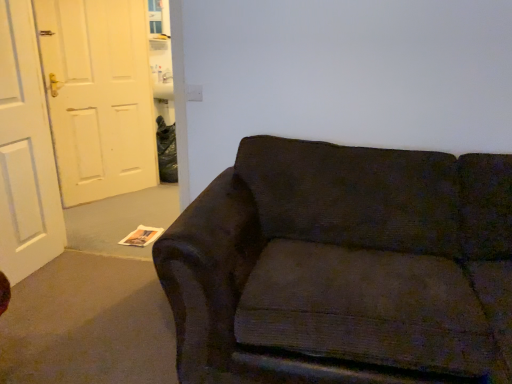
Question: Is white matte door at left, which is counted as the second door, starting from the front, completely or partially outside of dark fabric couch at center?

Choices:
 (A) yes
 (B) no

Answer: (A)

Question: Can you confirm if white matte door at left, the 1th door positioned from the back, is taller than dark fabric couch at center?

Choices:
 (A) no
 (B) yes

Answer: (B)

Question: Considering the relative sizes of white matte door at left, the 1th door positioned from the back, and dark fabric couch at center in the image provided, is white matte door at left, the 1th door positioned from the back, bigger than dark fabric couch at center?

Choices:
 (A) no
 (B) yes

Answer: (A)

Question: Is white matte door at left, which is counted as the second door, starting from the front, facing towards dark fabric couch at center?

Choices:
 (A) no
 (B) yes

Answer: (B)

Question: Does white matte door at left, which is counted as the second door, starting from the front, have a smaller size compared to dark fabric couch at center?

Choices:
 (A) no
 (B) yes

Answer: (B)

Question: Is dark fabric couch at center taller or shorter than white matte door at left, the first door in the front-to-back sequence?

Choices:
 (A) short
 (B) tall

Answer: (A)

Question: Is dark fabric couch at center to the left or to the right of white matte door at left, the first door in the front-to-back sequence, in the image?

Choices:
 (A) right
 (B) left

Answer: (A)

Question: Looking at their shapes, would you say dark fabric couch at center is wider or thinner than white matte door at left, arranged as the second door when viewed from the back?

Choices:
 (A) thin
 (B) wide

Answer: (B)

Question: Is dark fabric couch at center inside or outside of white matte door at left, arranged as the second door when viewed from the back?

Choices:
 (A) outside
 (B) inside

Answer: (A)

Question: Looking at the image, does white matte door at left, which is counted as the second door, starting from the front, seem bigger or smaller compared to dark fabric couch at center?

Choices:
 (A) small
 (B) big

Answer: (A)

Question: Does point (64, 200) appear closer or farther from the camera than point (222, 268)?

Choices:
 (A) farther
 (B) closer

Answer: (A)

Question: Considering the relative positions of white matte door at left, which is counted as the second door, starting from the front, and dark fabric couch at center in the image provided, is white matte door at left, which is counted as the second door, starting from the front, to the left or to the right of dark fabric couch at center?

Choices:
 (A) right
 (B) left

Answer: (B)

Question: From the image's perspective, is white matte door at left, the 1th door positioned from the back, located above or below dark fabric couch at center?

Choices:
 (A) above
 (B) below

Answer: (A)

Question: Is point (150, 94) positioned closer to the camera than point (53, 183)?

Choices:
 (A) closer
 (B) farther

Answer: (B)

Question: From a real-world perspective, is white matte door at left, which is counted as the second door, starting from the front, positioned above or below white matte door at left, the first door in the front-to-back sequence?

Choices:
 (A) above
 (B) below

Answer: (A)